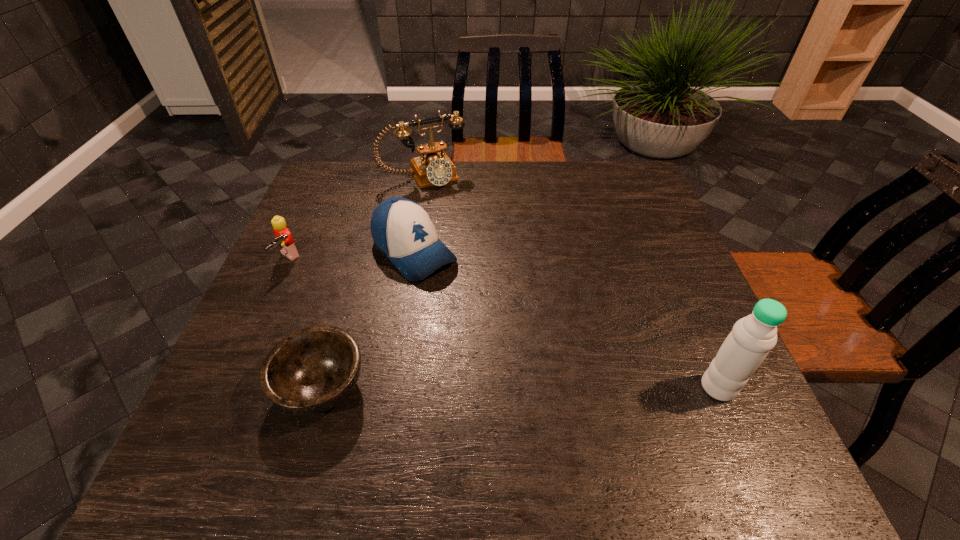
Image resolution: width=960 pixels, height=540 pixels. I want to click on vacant space located 0.100m in front of the Lego with the accessory visible, so click(317, 287).

Find the location of a particular element. free point located 0.070m in front of the Lego with the accessory visible is located at coordinates (309, 282).

Where is `free spot located 0.270m on the front-facing side of the baseball cap`? This screenshot has width=960, height=540. free spot located 0.270m on the front-facing side of the baseball cap is located at coordinates (517, 347).

Locate an element on the screen. The image size is (960, 540). vacant area situated on the front-facing side of the baseball cap is located at coordinates (541, 369).

The image size is (960, 540). Find the location of `blank area located 0.210m on the front-facing side of the baseball cap`. blank area located 0.210m on the front-facing side of the baseball cap is located at coordinates (498, 329).

Where is `vacant space located 0.170m on the dial number of the fourth shortest object`? Image resolution: width=960 pixels, height=540 pixels. vacant space located 0.170m on the dial number of the fourth shortest object is located at coordinates (459, 222).

I want to click on free region located 0.160m on the dial number of the fourth shortest object, so click(458, 220).

Where is `vacant space located on the dial number of the fourth shortest object`? vacant space located on the dial number of the fourth shortest object is located at coordinates (473, 244).

The width and height of the screenshot is (960, 540). I want to click on object that is at the far edge, so click(x=434, y=168).

Find the location of a particular element. bowl that is at the near edge is located at coordinates (312, 370).